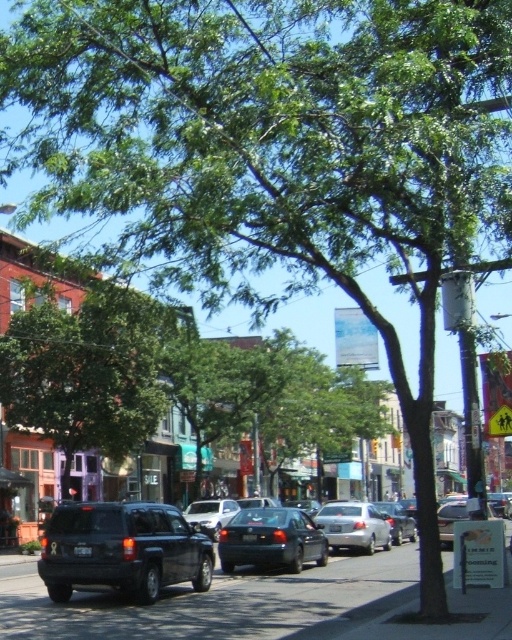
Measure the distance between green leafy tree at center and matte black suv at center.

The distance of green leafy tree at center from matte black suv at center is 8.03 meters.

Which is above, green leafy tree at center or matte black suv at center?

green leafy tree at center

The width and height of the screenshot is (512, 640). I want to click on green leafy tree at center, so click(86, 372).

Can you confirm if silver metallic sedan at center is wider than white matte sedan at center?

Yes, silver metallic sedan at center is wider than white matte sedan at center.

Where is `silver metallic sedan at center`? silver metallic sedan at center is located at coordinates (353, 525).

Describe the element at coordinates (353, 525) in the screenshot. This screenshot has width=512, height=640. I see `silver metallic sedan at center` at that location.

Find the location of a particular element. silver metallic sedan at center is located at coordinates (353, 525).

Between point (8, 417) and point (232, 564), which one is positioned behind?

Positioned behind is point (8, 417).

Describe the element at coordinates (86, 372) in the screenshot. I see `green leafy tree at center` at that location.

Identify the location of green leafy tree at center. The image size is (512, 640). (86, 372).